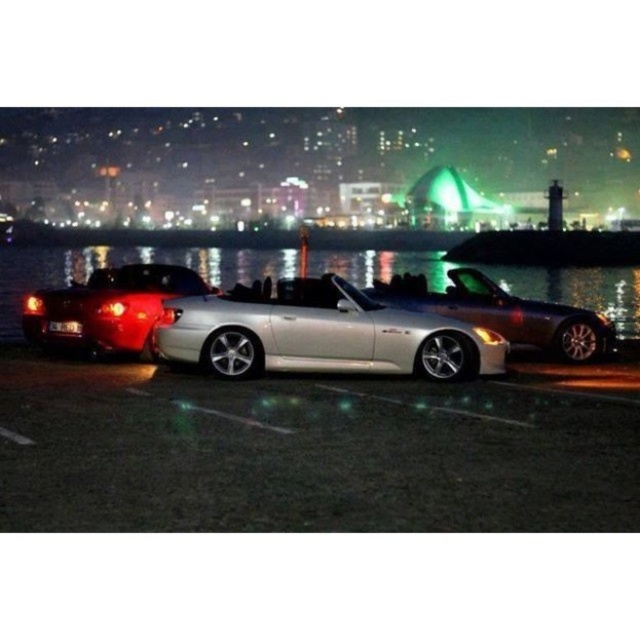
You are a photographer wanting to capture the silver metallic convertible at center and the satin silver convertible at center in a single frame. Given that your camera can only focus on objects within a 10m focal range, can both cars be captured clearly if they are positioned at different distances from the camera?

The silver metallic convertible at center is bigger than the satin silver convertible at center, but their distance from the camera isn

You are standing in front of the three convertible sports cars parked along the waterfront. You notice two points marked on the cars. The first point is at coordinates point (93, 260) and the second is at point (44, 323). Which point is closer to you?

Point (93, 260) is further to the viewer than point (44, 323), so the second point is closer to you.